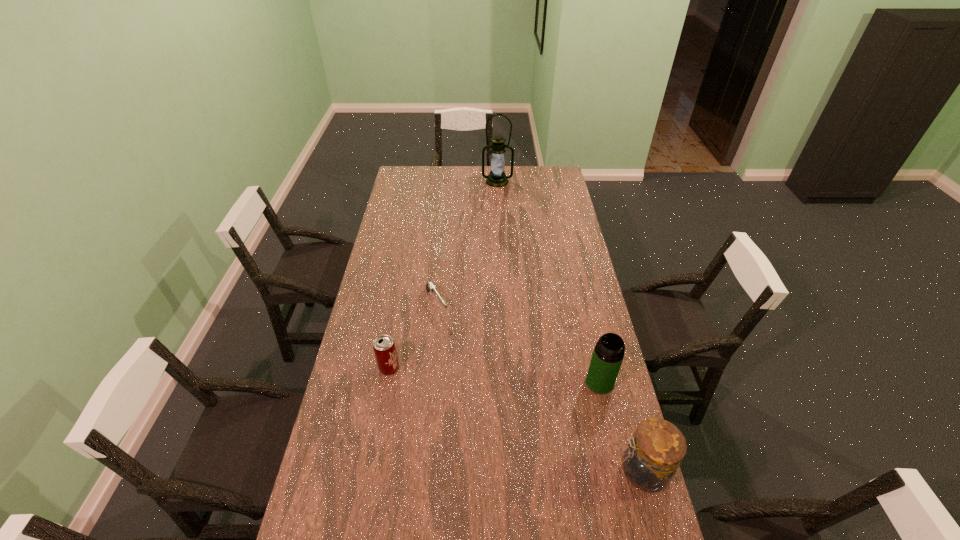
You are a GUI agent. You are given a task and a screenshot of the screen. Output one action in this format:
    pyautogui.click(x=<x>, y=<y>)
    Task: Click on the vacant area situated 0.250m on the lid of the jar
    Image resolution: width=960 pixels, height=540 pixels.
    Given the screenshot: What is the action you would take?
    pyautogui.click(x=528, y=471)

What are the coordinates of `vacant space located 0.070m on the lid of the jar` in the screenshot? It's located at (590, 471).

The width and height of the screenshot is (960, 540). Identify the location of blank space located 0.340m on the lid of the jar. (497, 471).

At what (x,y) coordinates should I click in order to perform the action: click on vacant area located from the spout of the second tallest object. Please return your answer as a coordinate pair (x, y). This screenshot has width=960, height=540. Looking at the image, I should click on (475, 417).

Identify the location of blank space located from the spout of the second tallest object. The image size is (960, 540). (534, 401).

I want to click on vacant space positioned from the spout of the second tallest object, so click(x=485, y=414).

Find the location of a particular element. The width and height of the screenshot is (960, 540). vacant space located on the front-facing side of the pistol is located at coordinates (485, 383).

Where is `blank area located on the front-facing side of the pistol`? This screenshot has width=960, height=540. blank area located on the front-facing side of the pistol is located at coordinates (476, 370).

Where is `vacant space located on the front-facing side of the pistol`? This screenshot has height=540, width=960. vacant space located on the front-facing side of the pistol is located at coordinates (483, 381).

The image size is (960, 540). I want to click on vacant space located on the side where the third object from right to left emits light, so click(497, 194).